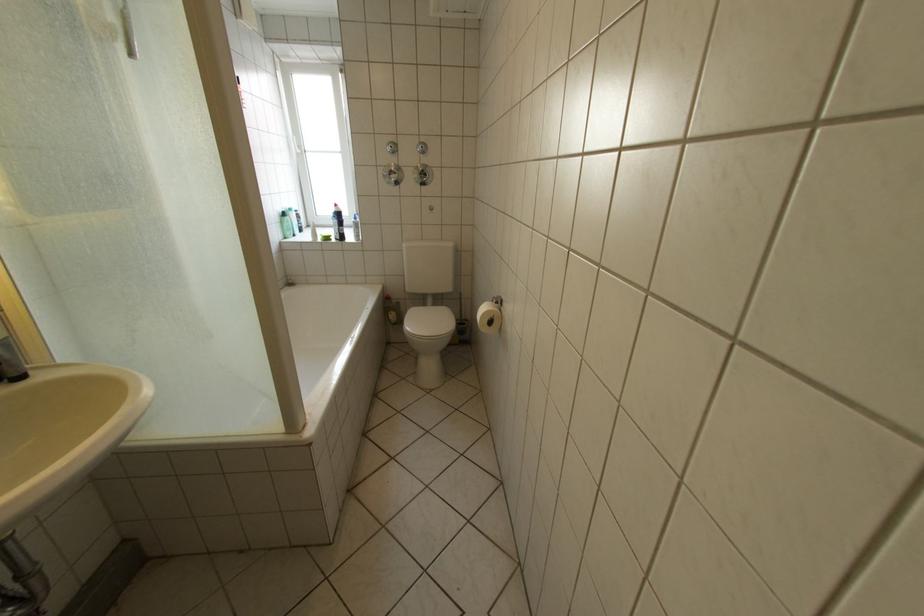
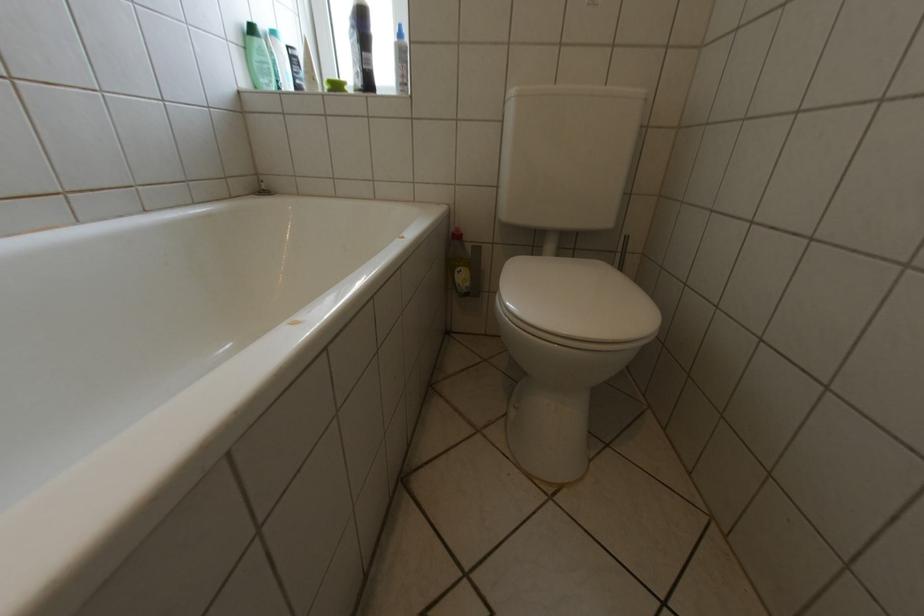
Locate, in the second image, the point that corresponds to point (344, 238) in the first image.

(359, 90)